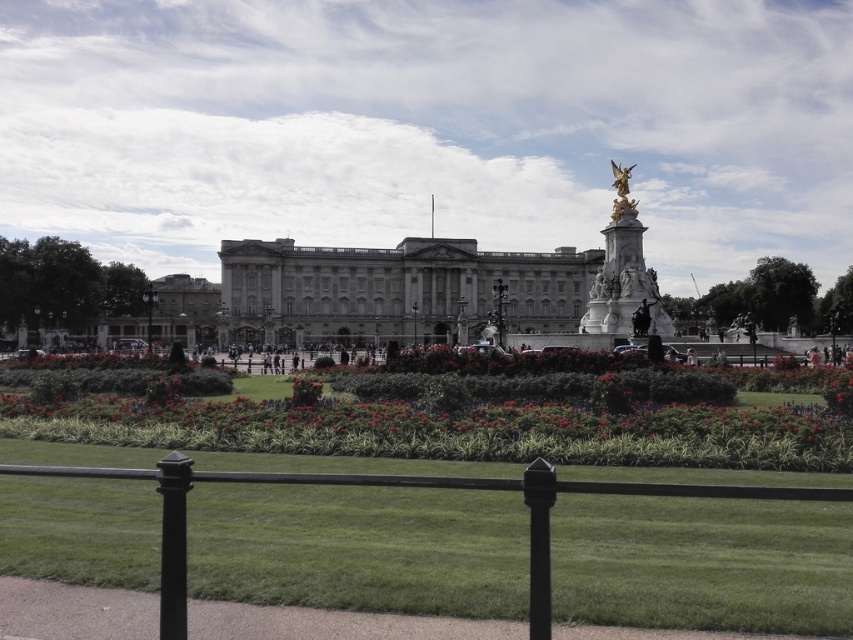
Who is more forward, [616,285] or [618,216]?

Point [616,285] is in front.

Is the position of white marble statue at upper right less distant than that of gold polished statue at upper center?

Yes, white marble statue at upper right is closer to the viewer.

The height and width of the screenshot is (640, 853). Identify the location of white marble statue at upper right. (624, 273).

This screenshot has width=853, height=640. Identify the location of white marble statue at upper right. (624, 273).

Can you confirm if green grass at center is positioned to the right of gold polished statue at upper center?

In fact, green grass at center is to the left of gold polished statue at upper center.

What do you see at coordinates (451, 429) in the screenshot?
I see `green grass at center` at bounding box center [451, 429].

Where is `green grass at center`? The width and height of the screenshot is (853, 640). green grass at center is located at coordinates (451, 429).

Is point (566, 264) behind point (624, 193)?

Yes.

Is white stone building at center below gold polished statue at upper center?

Indeed, white stone building at center is positioned under gold polished statue at upper center.

Between point (231, 280) and point (619, 212), which one is positioned in front?

Point (619, 212) is more forward.

This screenshot has width=853, height=640. In order to click on white stone building at center in this screenshot , I will do `click(393, 289)`.